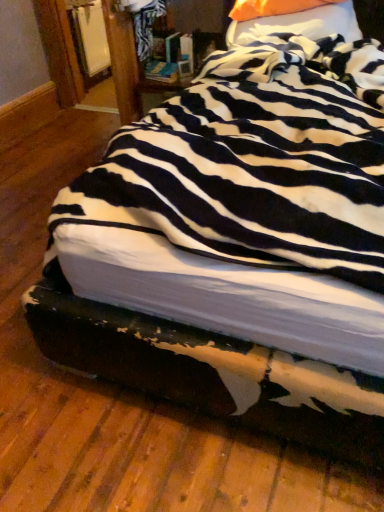
Question: Is orange fabric pillow at upper center, which is the first pillow in top-to-bottom order, wider or thinner than orange fabric pillow at upper center, arranged as the second pillow when viewed from the top?

Choices:
 (A) thin
 (B) wide

Answer: (A)

Question: From the image's perspective, is orange fabric pillow at upper center, which is the first pillow in top-to-bottom order, positioned above or below orange fabric pillow at upper center, which is the 1th pillow in bottom-to-top order?

Choices:
 (A) below
 (B) above

Answer: (B)

Question: In terms of size, does orange fabric pillow at upper center, which is the first pillow in top-to-bottom order, appear bigger or smaller than orange fabric pillow at upper center, arranged as the second pillow when viewed from the top?

Choices:
 (A) small
 (B) big

Answer: (A)

Question: Based on their sizes in the image, would you say orange fabric pillow at upper center, arranged as the second pillow when viewed from the top, is bigger or smaller than orange fabric pillow at upper center, acting as the 2th pillow starting from the bottom?

Choices:
 (A) big
 (B) small

Answer: (A)

Question: From a real-world perspective, is orange fabric pillow at upper center, which is the 1th pillow in bottom-to-top order, physically located above or below orange fabric pillow at upper center, which is the first pillow in top-to-bottom order?

Choices:
 (A) above
 (B) below

Answer: (B)

Question: Considering the positions of point (294, 22) and point (248, 0), is point (294, 22) closer or farther from the camera than point (248, 0)?

Choices:
 (A) closer
 (B) farther

Answer: (A)

Question: In the image, is orange fabric pillow at upper center, which is the 1th pillow in bottom-to-top order, positioned in front of or behind orange fabric pillow at upper center, which is the first pillow in top-to-bottom order?

Choices:
 (A) front
 (B) behind

Answer: (A)